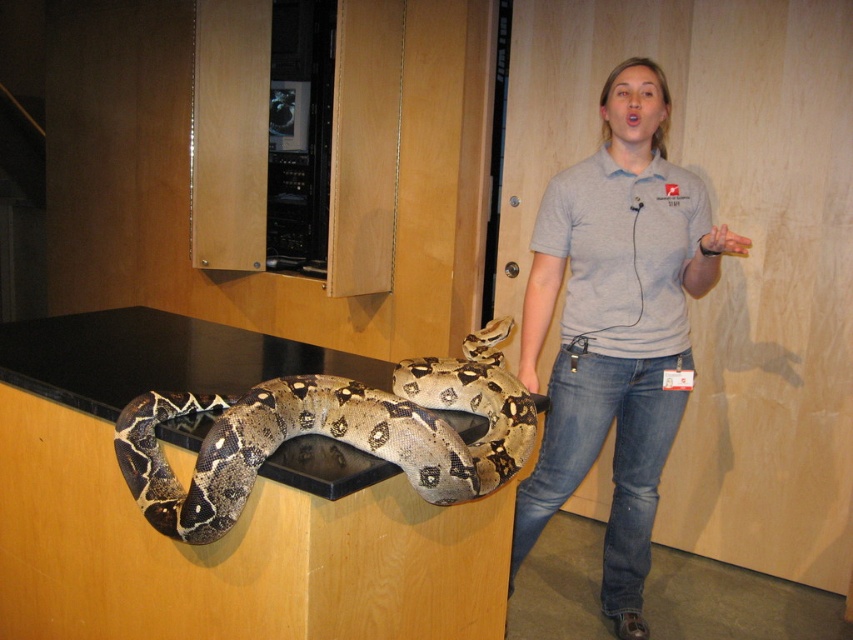
Can you confirm if gray cotton shirt at center is thinner than brown patterned snake at center?

Yes.

Is gray cotton shirt at center wider than brown patterned snake at center?

Incorrect, gray cotton shirt at center's width does not surpass brown patterned snake at center's.

Measure the distance between gray cotton shirt at center and camera.

They are 1.70 meters apart.

Identify the location of gray cotton shirt at center. (616, 326).